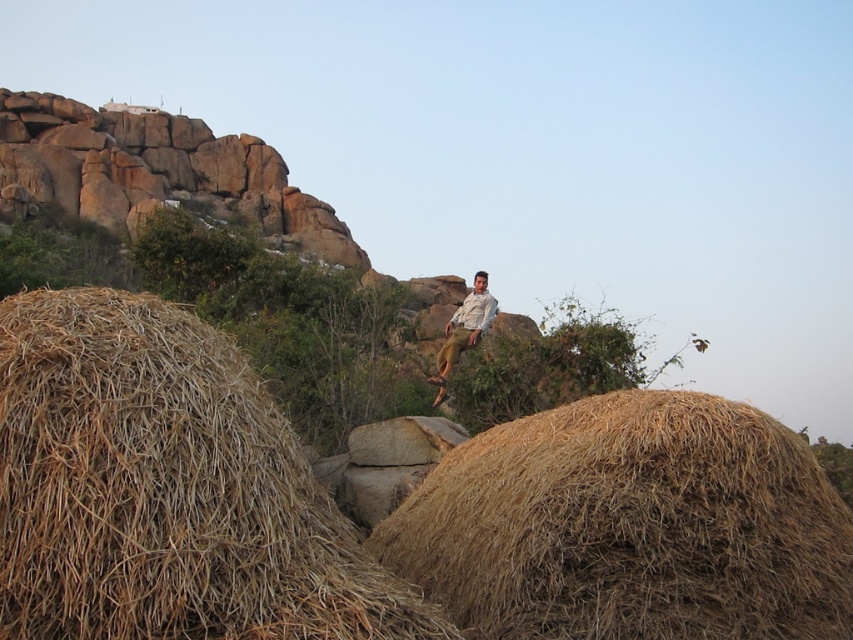
Consider the image. You are a photographer planning to take a picture of the light brown shirt at center and the brown straw bale at lower left. Based on their positions, which object will appear closer to the bottom of the photo?

The brown straw bale at lower left will appear closer to the bottom of the photo because it is located below the light brown shirt at center.

You are a hiker trying to navigate between the two hay bales. The first bale is at point (187, 461) and the second is at point 0.822, 0.320. Can you safely walk between them if your path must stay within 10 feet of each bale?

The distance between the two hay bales is 67.23 feet. Since your path must stay within 10 feet of each bale, the total allowable distance would be 20 feet. However, the actual distance between them is much greater than that, so you cannot safely walk between them within the required proximity.

From the picture: You are standing at the center of the image and want to place a new hay bale exactly where the brown straw bale at center is located. What are the coordinates you should input into your GPS device to place it there?

The coordinates for the brown straw bale at center are 0.823 in the x direction and 0.739 in the y direction, so you should input (630, 525) into your GPS device.